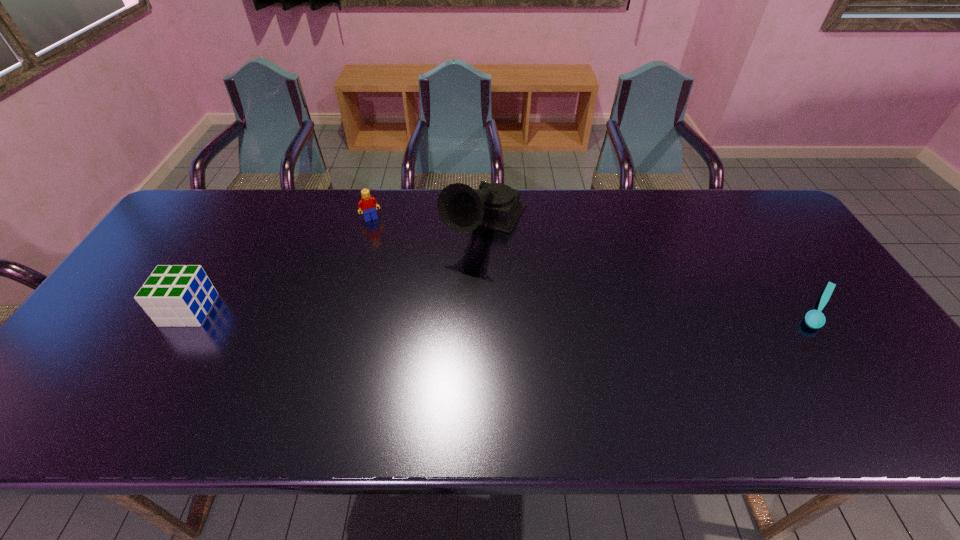
At what (x,y) coordinates should I click in order to perform the action: click on empty location between the second object from left to right and the tallest object. Please return your answer as a coordinate pair (x, y). Image resolution: width=960 pixels, height=540 pixels. Looking at the image, I should click on (428, 222).

Locate an element on the screen. This screenshot has height=540, width=960. vacant area that lies between the third object from right to left and the phonograph_record is located at coordinates (428, 222).

The width and height of the screenshot is (960, 540). In order to click on vacant region between the second object from right to left and the rightmost object in this screenshot , I will do `click(653, 268)`.

This screenshot has height=540, width=960. In order to click on the second closest object to the leftmost object in this screenshot , I will do `click(461, 208)`.

Identify the location of object identified as the second closest to the second object from left to right. (178, 295).